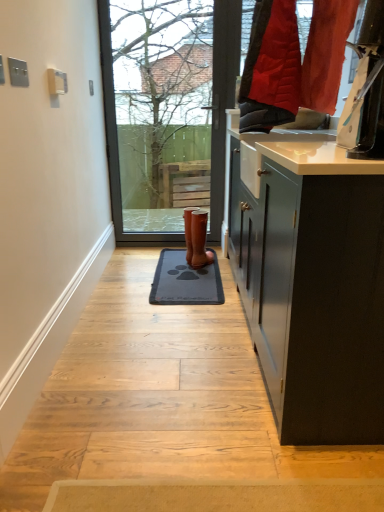
Question: Does bare branches at upper center have a greater height compared to brown leather boot at center?

Choices:
 (A) yes
 (B) no

Answer: (A)

Question: Can you confirm if bare branches at upper center is bigger than brown leather boot at center?

Choices:
 (A) yes
 (B) no

Answer: (A)

Question: Is the depth of bare branches at upper center less than that of brown leather boot at center?

Choices:
 (A) no
 (B) yes

Answer: (A)

Question: Is bare branches at upper center wider than brown leather boot at center?

Choices:
 (A) no
 (B) yes

Answer: (A)

Question: Is bare branches at upper center outside brown leather boot at center?

Choices:
 (A) no
 (B) yes

Answer: (B)

Question: From the image's perspective, is bare branches at upper center on top of brown leather boot at center?

Choices:
 (A) yes
 (B) no

Answer: (A)

Question: Would you consider dark gray rubber doormat at center to be distant from brown leather boot at center?

Choices:
 (A) yes
 (B) no

Answer: (B)

Question: From a real-world perspective, is dark gray rubber doormat at center positioned under brown leather boot at center based on gravity?

Choices:
 (A) yes
 (B) no

Answer: (A)

Question: Is dark gray rubber doormat at center at the right side of brown leather boot at center?

Choices:
 (A) yes
 (B) no

Answer: (B)

Question: Considering the relative sizes of dark gray rubber doormat at center and brown leather boot at center in the image provided, is dark gray rubber doormat at center shorter than brown leather boot at center?

Choices:
 (A) yes
 (B) no

Answer: (A)

Question: Is dark gray rubber doormat at center taller than brown leather boot at center?

Choices:
 (A) no
 (B) yes

Answer: (A)

Question: From the image's perspective, does dark gray rubber doormat at center appear higher than brown leather boot at center?

Choices:
 (A) yes
 (B) no

Answer: (B)

Question: From a real-world perspective, is bare branches at upper center located higher than dark gray rubber doormat at center?

Choices:
 (A) yes
 (B) no

Answer: (A)